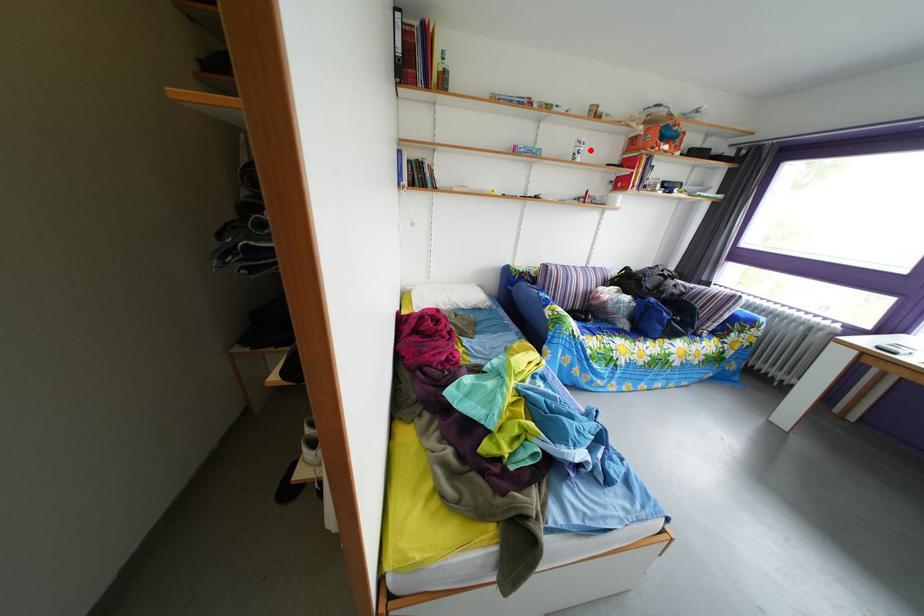
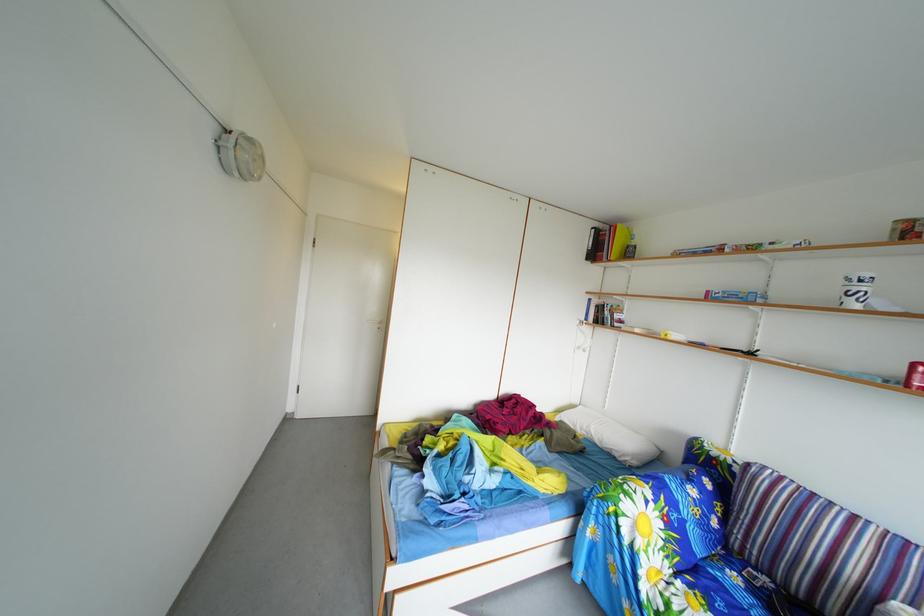
Question: A red point is marked in image1. In image2, is the corresponding 3D point closer to the camera or farther? Reply with the corresponding letter.

Choices:
 (A) The corresponding 3D point is closer.
 (B) The corresponding 3D point is farther.

Answer: (B)